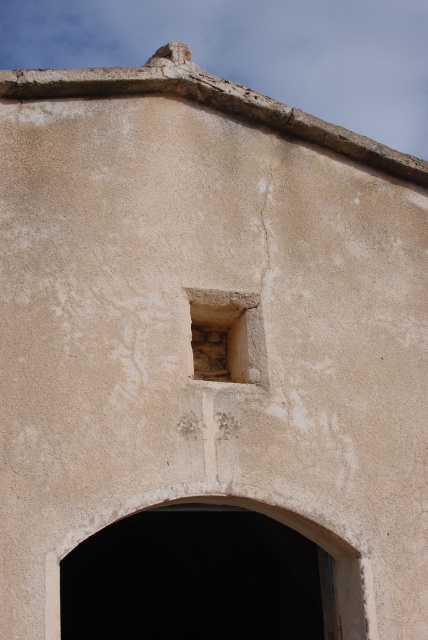
Does point (356, 582) come farther from viewer compared to point (204, 364)?

No, it is not.

How much distance is there between transparent glass window at upper center and rough stone window at upper center?

transparent glass window at upper center and rough stone window at upper center are 12.23 feet apart from each other.

Locate an element on the screen. This screenshot has height=640, width=428. transparent glass window at upper center is located at coordinates (265, 515).

I want to click on transparent glass window at upper center, so click(265, 515).